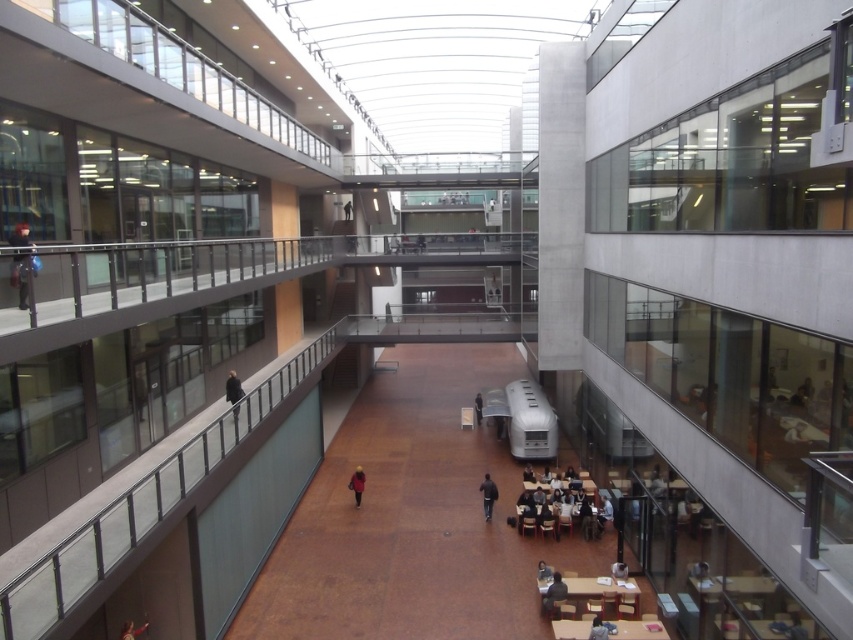
You are standing in the atrium and want to pick up the matte black backpack at left and the dark blue hoodie at lower center. Which object is closer to you?

The matte black backpack at left is closer to you because it is in front of the dark blue hoodie at lower center.

Consider the image. You are a person standing in the atrium and need to pick up both the matte black backpack at left and the dark blue hoodie at lower center. Can you walk directly between them without needing to climb any stairs or use elevators?

The matte black backpack at left and dark blue hoodie at lower center are 11.57 meters apart. Since the atrium is a single level with no stairs or elevators mentioned between them, you can walk directly between them.